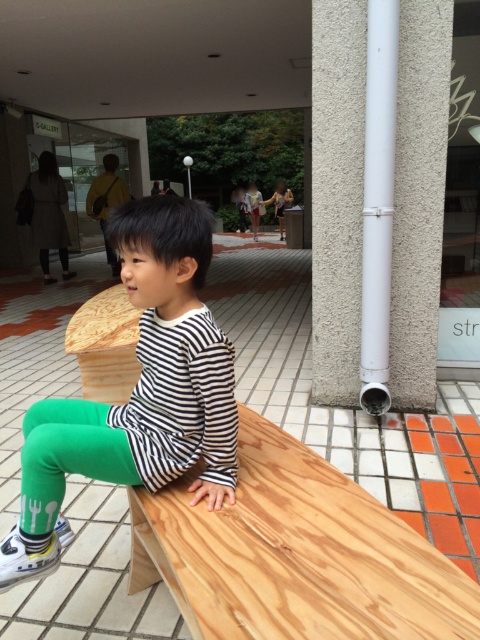
You are a fashion designer observing the child in the image. You need to determine which clothing item is longer between the green cotton pants at center and the green matte leggings at lower left. Which one is longer?

The green cotton pants at center is much taller than the green matte leggings at lower left, so the green cotton pants at center is longer.